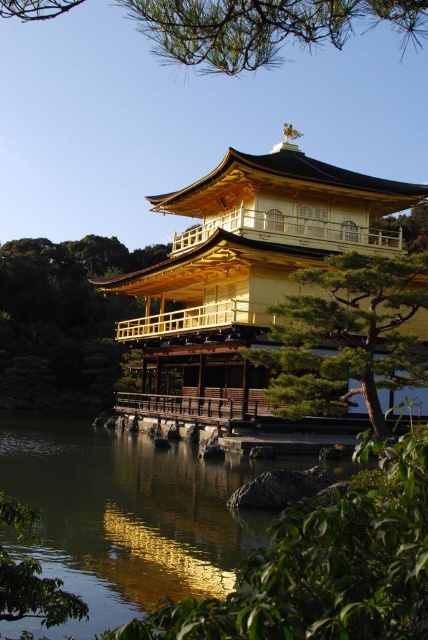
Question: Can you confirm if green leafy tree at center is bigger than green leafy tree at lower left?

Choices:
 (A) no
 (B) yes

Answer: (B)

Question: Which is nearer to the golden polished wood pagoda at center?

Choices:
 (A) green leafy tree at lower left
 (B) green leafy tree at center
 (C) green pine branches at upper center

Answer: (C)

Question: Which point is closer to the camera taking this photo?

Choices:
 (A) (321, 0)
 (B) (110, 400)

Answer: (A)

Question: Does green textured pine tree at center lie in front of green pine branches at upper center?

Choices:
 (A) no
 (B) yes

Answer: (A)

Question: Based on their relative distances, which object is nearer to the green pine branches at upper center?

Choices:
 (A) golden polished wood pagoda at center
 (B) green textured pine tree at center
 (C) green leafy tree at center
 (D) green leafy tree at lower left

Answer: (B)

Question: Does golden polished wood pagoda at center have a smaller size compared to green leafy tree at lower left?

Choices:
 (A) no
 (B) yes

Answer: (A)